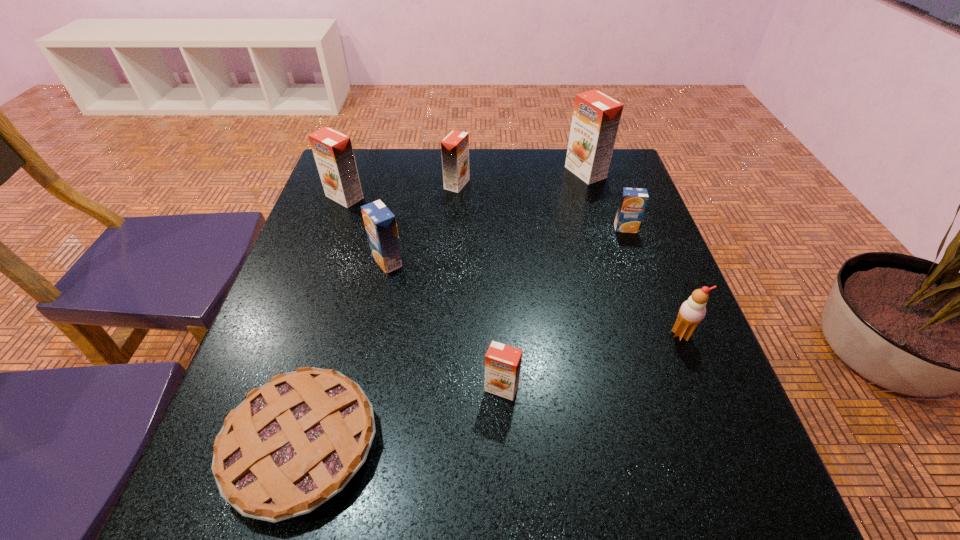
The width and height of the screenshot is (960, 540). In order to click on vacant space at the near edge of the desktop in this screenshot , I will do `click(655, 494)`.

Find the location of a particular element. The height and width of the screenshot is (540, 960). vacant region at the left edge is located at coordinates (342, 290).

At what (x,y) coordinates should I click in order to perform the action: click on free location at the far left corner. Please return your answer as a coordinate pair (x, y). This screenshot has height=540, width=960. Looking at the image, I should click on (361, 151).

The image size is (960, 540). What are the coordinates of `vacant area at the far right corner of the desktop` in the screenshot? It's located at (619, 157).

The width and height of the screenshot is (960, 540). In the image, there is a desktop. In order to click on free space at the near right corner in this screenshot , I will do `click(697, 499)`.

Locate an element on the screen. unoccupied area between the shortest object and the tallest orange juice is located at coordinates pos(444,308).

Locate an element on the screen. The width and height of the screenshot is (960, 540). vacant area that lies between the third orange orange juice from right to left and the rightmost orange orange juice is located at coordinates (521, 178).

Identify the location of free space between the pie and the third biggest orange orange juice. (379, 314).

The width and height of the screenshot is (960, 540). I want to click on free space between the tallest orange juice and the third nearest object, so click(634, 253).

I want to click on free spot between the nearest orange orange juice and the leftmost orange orange juice, so click(423, 293).